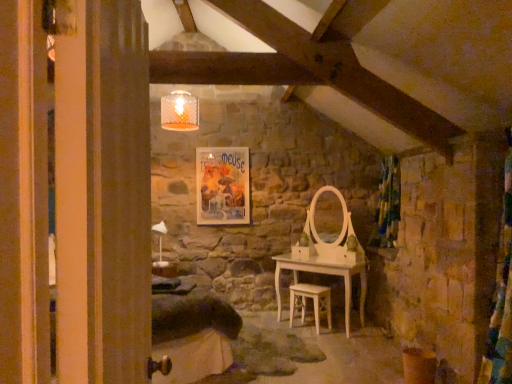
Locate an element on the screen. Image resolution: width=512 pixels, height=384 pixels. light wood chair at center is located at coordinates (312, 300).

The height and width of the screenshot is (384, 512). I want to click on matte paper poster at center, so click(x=223, y=185).

Find the location of a particular element. chair on the left of the velvet green curtain at right is located at coordinates pyautogui.click(x=312, y=300).

Which is in front, velvet green curtain at right or light wood chair at center?

light wood chair at center is more forward.

Is velvet green curtain at right beside light wood chair at center?

velvet green curtain at right and light wood chair at center are not in contact.

Which of these two, velvet green curtain at right or light wood chair at center, stands taller?

With more height is velvet green curtain at right.

Measure the distance between light wood chair at center and velvet green curtain at right.

3.56 feet.

Is light wood chair at center oriented towards velvet green curtain at right?

No.

Is light wood chair at center positioned beyond the bounds of velvet green curtain at right?

light wood chair at center lies outside velvet green curtain at right's area.

Is the depth of light wood chair at center greater than that of velvet green curtain at right?

No, it is not.

What are the coordinates of `picture frame behind the velvet green curtain at right` in the screenshot? It's located at (223, 185).

Is velvet green curtain at right positioned with its back to matte paper poster at center?

velvet green curtain at right is not turned away from matte paper poster at center.

Which object is wider, velvet green curtain at right or matte paper poster at center?

Wider between the two is velvet green curtain at right.

Does velvet green curtain at right have a larger size compared to matte paper poster at center?

Yes, velvet green curtain at right is bigger than matte paper poster at center.

At what (x,y) coordinates should I click in order to perform the action: click on chair below the matte paper poster at center (from a real-world perspective). Please return your answer as a coordinate pair (x, y). Looking at the image, I should click on (312, 300).

From the image's perspective, which object appears higher, matte paper poster at center or light wood chair at center?

matte paper poster at center appears higher in the image.

Considering the relative sizes of matte paper poster at center and light wood chair at center in the image provided, is matte paper poster at center taller than light wood chair at center?

Correct, matte paper poster at center is much taller as light wood chair at center.

Does matte paper poster at center appear on the right side of light wood chair at center?

No.

From the picture: Does light wood chair at center have a larger size compared to matte paper poster at center?

Indeed, light wood chair at center has a larger size compared to matte paper poster at center.

From the picture: From the image's perspective, would you say light wood chair at center is positioned over matte paper poster at center?

No.

Looking at this image, which object is closer to the camera, light wood chair at center or matte paper poster at center?

light wood chair at center is closer to the camera.

From a real-world perspective, is matte paper poster at center positioned under velvet green curtain at right based on gravity?

No, from a real-world perspective, matte paper poster at center is not under velvet green curtain at right.

Where is `curtain below the matte paper poster at center (from the image's perspective)`? The image size is (512, 384). curtain below the matte paper poster at center (from the image's perspective) is located at coordinates [388, 204].

How many degrees apart are the facing directions of matte paper poster at center and velvet green curtain at right?

matte paper poster at center and velvet green curtain at right are facing 89.5 degrees away from each other.

Is matte paper poster at center next to velvet green curtain at right and touching it?

No, matte paper poster at center is not next to velvet green curtain at right.

You are a GUI agent. You are given a task and a screenshot of the screen. Output one action in this format:
    pyautogui.click(x=<x>, y=<y>)
    Task: Click on the curtain lying on the right of light wood chair at center
    The image size is (512, 384).
    Given the screenshot: What is the action you would take?
    pyautogui.click(x=388, y=204)

At what (x,y) coordinates should I click in order to perform the action: click on curtain behind the light wood chair at center. Please return your answer as a coordinate pair (x, y). The image size is (512, 384). Looking at the image, I should click on (388, 204).

Based on their spatial positions, is matte paper poster at center or velvet green curtain at right further from light wood chair at center?

matte paper poster at center is positioned further to the anchor light wood chair at center.

When comparing their distances from matte paper poster at center, does velvet green curtain at right or light wood chair at center seem further?

velvet green curtain at right is further to matte paper poster at center.

Based on their spatial positions, is light wood chair at center or matte paper poster at center closer to velvet green curtain at right?

The object closer to velvet green curtain at right is light wood chair at center.

Based on their spatial positions, is light wood chair at center or velvet green curtain at right further from matte paper poster at center?

Based on the image, velvet green curtain at right appears to be further to matte paper poster at center.

Looking at the image, which one is located further to light wood chair at center, velvet green curtain at right or matte paper poster at center?

matte paper poster at center lies further to light wood chair at center than the other object.

Considering their positions, is matte paper poster at center positioned further to velvet green curtain at right than light wood chair at center?

matte paper poster at center is positioned further to the anchor velvet green curtain at right.

Image resolution: width=512 pixels, height=384 pixels. Find the location of `chair located between matte paper poster at center and velvet green curtain at right in the left-right direction`. chair located between matte paper poster at center and velvet green curtain at right in the left-right direction is located at coordinates (x=312, y=300).